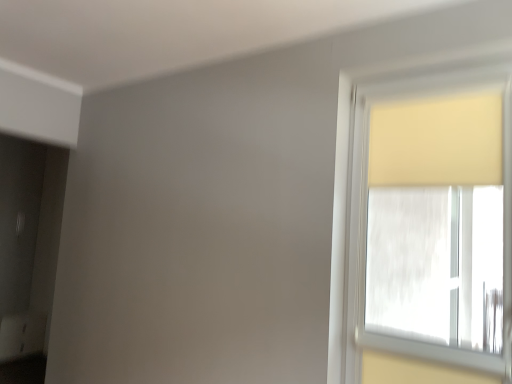
Question: Is beige fabric curtain at upper right smaller than matte yellow curtain at right?

Choices:
 (A) yes
 (B) no

Answer: (A)

Question: Is beige fabric curtain at upper right facing away from matte yellow curtain at right?

Choices:
 (A) yes
 (B) no

Answer: (A)

Question: Is beige fabric curtain at upper right directly adjacent to matte yellow curtain at right?

Choices:
 (A) yes
 (B) no

Answer: (B)

Question: Does beige fabric curtain at upper right have a lesser height compared to matte yellow curtain at right?

Choices:
 (A) no
 (B) yes

Answer: (B)

Question: From a real-world perspective, does beige fabric curtain at upper right stand above matte yellow curtain at right?

Choices:
 (A) yes
 (B) no

Answer: (A)

Question: From the image's perspective, would you say beige fabric curtain at upper right is positioned over matte yellow curtain at right?

Choices:
 (A) yes
 (B) no

Answer: (A)

Question: Can you confirm if matte yellow curtain at right is positioned to the left of beige fabric curtain at upper right?

Choices:
 (A) yes
 (B) no

Answer: (A)

Question: Can you confirm if matte yellow curtain at right is shorter than beige fabric curtain at upper right?

Choices:
 (A) yes
 (B) no

Answer: (B)

Question: Does matte yellow curtain at right come in front of beige fabric curtain at upper right?

Choices:
 (A) yes
 (B) no

Answer: (A)

Question: From the image's perspective, is matte yellow curtain at right located above beige fabric curtain at upper right?

Choices:
 (A) yes
 (B) no

Answer: (B)

Question: Is matte yellow curtain at right positioned beyond the bounds of beige fabric curtain at upper right?

Choices:
 (A) yes
 (B) no

Answer: (A)

Question: Is matte yellow curtain at right thinner than beige fabric curtain at upper right?

Choices:
 (A) no
 (B) yes

Answer: (A)

Question: Is matte yellow curtain at right wider or thinner than beige fabric curtain at upper right?

Choices:
 (A) wide
 (B) thin

Answer: (A)